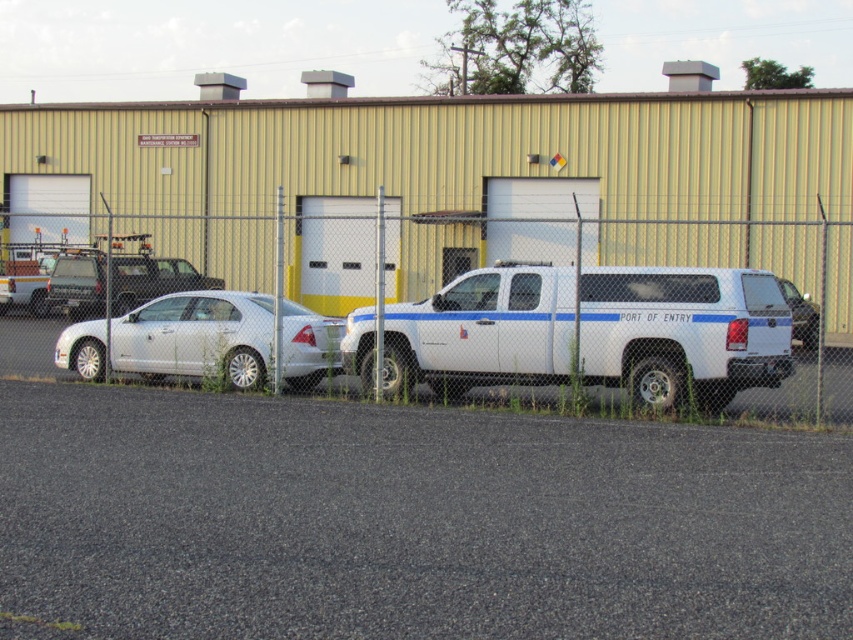
Question: Can you confirm if gray asphalt parking lot at lower center is positioned below white matte truck at center?

Choices:
 (A) no
 (B) yes

Answer: (B)

Question: Can you confirm if white matte sedan at left is positioned below white glossy truck at center?

Choices:
 (A) no
 (B) yes

Answer: (B)

Question: Which of these objects is positioned closest to the white matte sedan at left?

Choices:
 (A) white glossy truck at center
 (B) white matte truck at center
 (C) gray asphalt parking lot at lower center
 (D) metallic chain-link fence at center

Answer: (D)

Question: Estimate the real-world distances between objects in this image. Which object is farther from the white glossy truck at center?

Choices:
 (A) white matte sedan at left
 (B) gray asphalt parking lot at lower center

Answer: (A)

Question: Which point is closer to the camera taking this photo?

Choices:
 (A) (810, 337)
 (B) (157, 342)
 (C) (206, 609)
 (D) (607, 256)

Answer: (C)

Question: Does white matte truck at center have a larger size compared to white glossy truck at center?

Choices:
 (A) no
 (B) yes

Answer: (B)